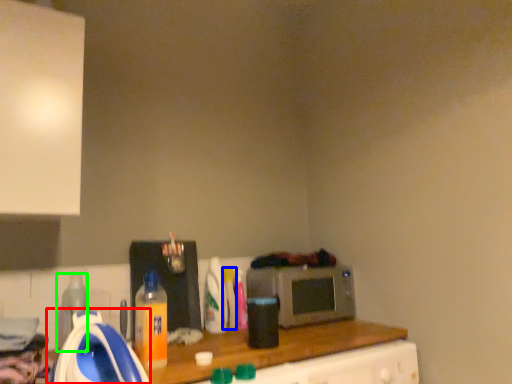
Question: Which object is the farthest from appliance (highlighted by a red box)? Choose among these: bottle (highlighted by a blue box) or bottle (highlighted by a green box).

Choices:
 (A) bottle
 (B) bottle

Answer: (A)